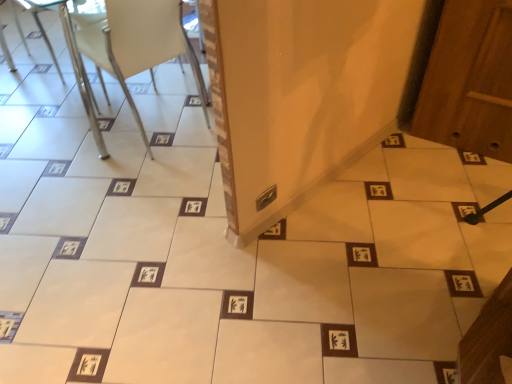
Question: Would you say white plastic chair at upper left is to the left or to the right of metallic silver chair at upper left in the picture?

Choices:
 (A) left
 (B) right

Answer: (B)

Question: Considering the positions of white plastic chair at upper left and metallic silver chair at upper left in the image, is white plastic chair at upper left wider or thinner than metallic silver chair at upper left?

Choices:
 (A) thin
 (B) wide

Answer: (B)

Question: From a real-world perspective, is white plastic chair at upper left physically located above or below metallic silver chair at upper left?

Choices:
 (A) above
 (B) below

Answer: (A)

Question: Is metallic silver chair at upper left in front of or behind white plastic chair at upper left in the image?

Choices:
 (A) front
 (B) behind

Answer: (B)

Question: Considering the positions of metallic silver chair at upper left and white plastic chair at upper left in the image, is metallic silver chair at upper left wider or thinner than white plastic chair at upper left?

Choices:
 (A) wide
 (B) thin

Answer: (B)

Question: Is metallic silver chair at upper left situated inside white plastic chair at upper left or outside?

Choices:
 (A) inside
 (B) outside

Answer: (B)

Question: Is metallic silver chair at upper left taller or shorter than white plastic chair at upper left?

Choices:
 (A) short
 (B) tall

Answer: (A)